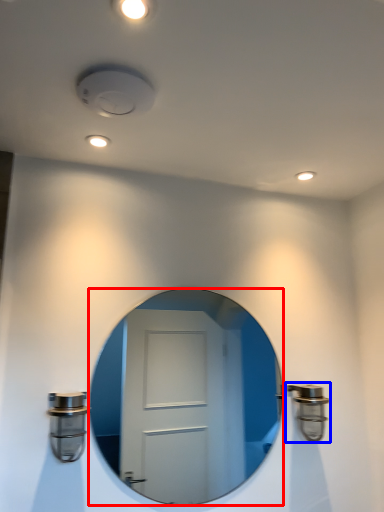
Question: Which object is closer to the camera taking this photo, mirror (highlighted by a red box) or door handle (highlighted by a blue box)?

Choices:
 (A) mirror
 (B) door handle

Answer: (A)